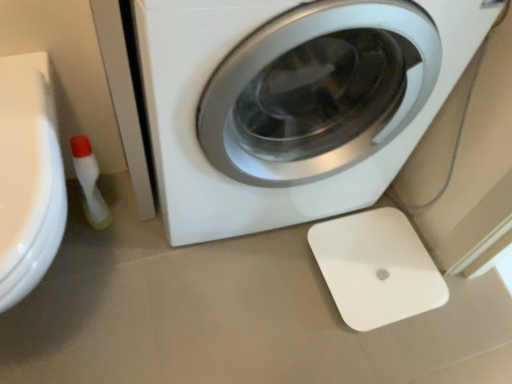
At what (x,y) coordinates should I click in order to perform the action: click on unoccupied space behind translucent plastic bottle at lower left. Please return your answer as a coordinate pair (x, y). The image size is (512, 384). Looking at the image, I should click on (115, 188).